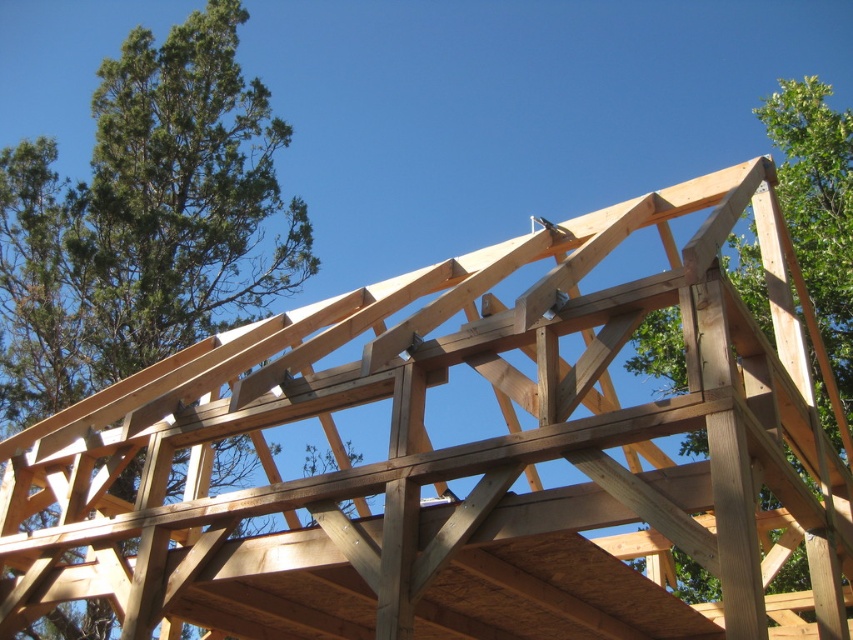
Which is in front, point (154, 164) or point (830, 312)?

Point (830, 312) is more forward.

Does point (251, 298) lie in front of point (776, 147)?

No, (251, 298) is further to viewer.

Who is more forward, (172, 236) or (816, 180)?

Positioned in front is point (816, 180).

Where is `green leafy tree at upper left`? This screenshot has height=640, width=853. green leafy tree at upper left is located at coordinates (144, 220).